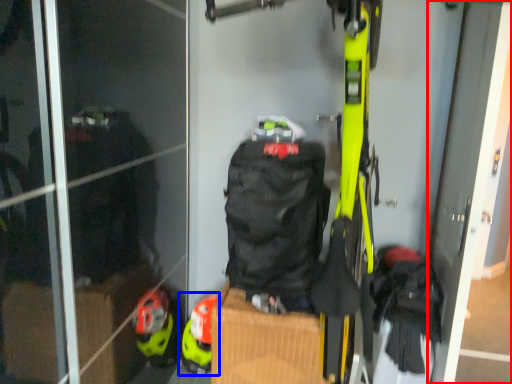
Question: Which object is closer to the camera taking this photo, screen door (highlighted by a red box) or footwear (highlighted by a blue box)?

Choices:
 (A) screen door
 (B) footwear

Answer: (A)